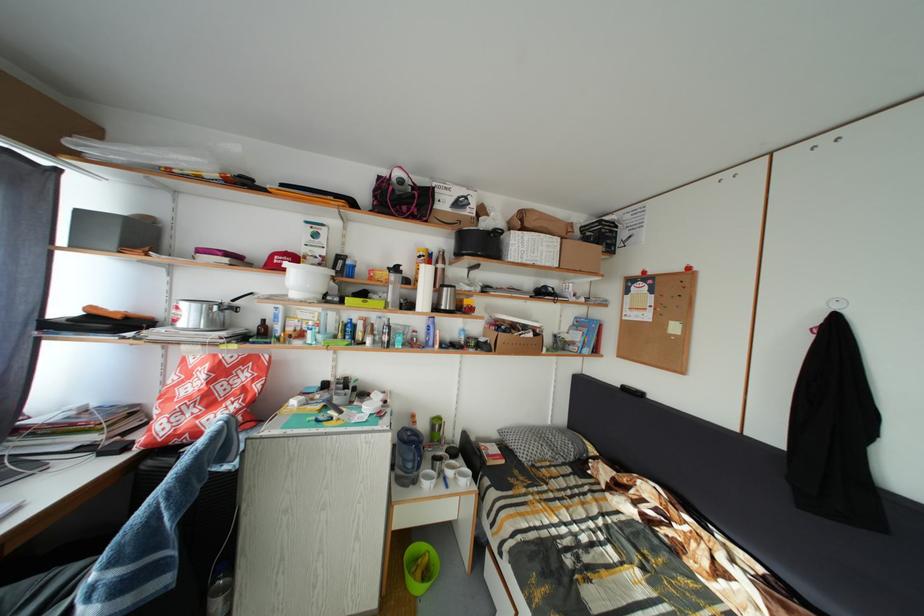
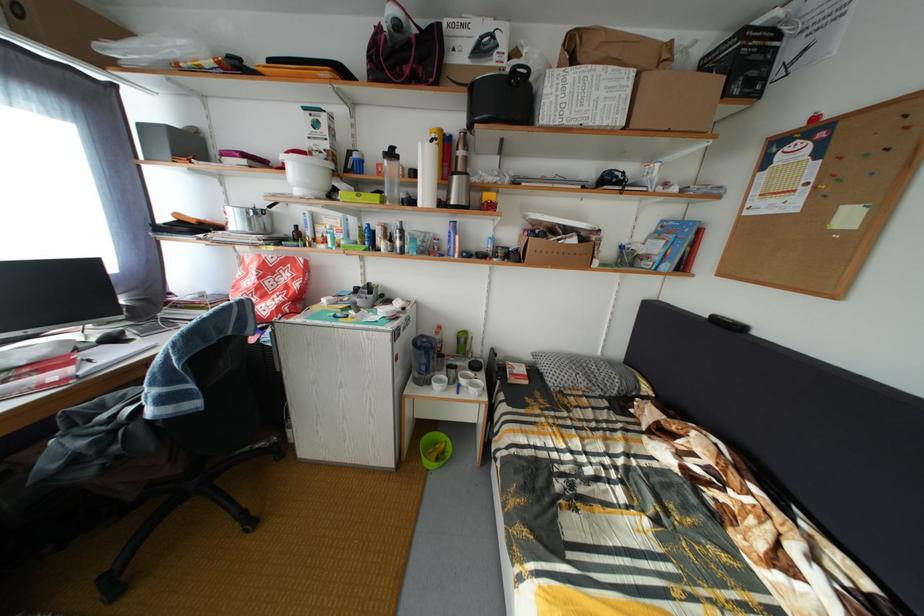
Where in the second image is the point corresponding to (238,367) from the first image?

(281, 267)